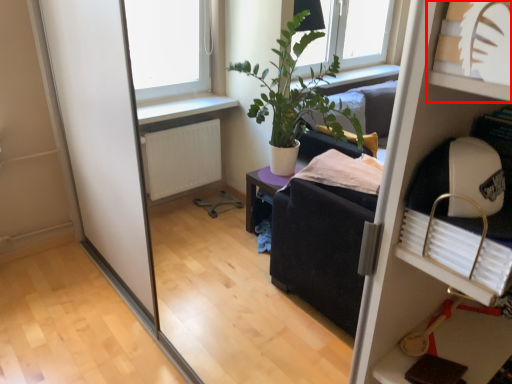
Question: From the image's perspective, what is the correct spatial relationship of shelf (annotated by the red box) in relation to shelf?

Choices:
 (A) below
 (B) above

Answer: (B)